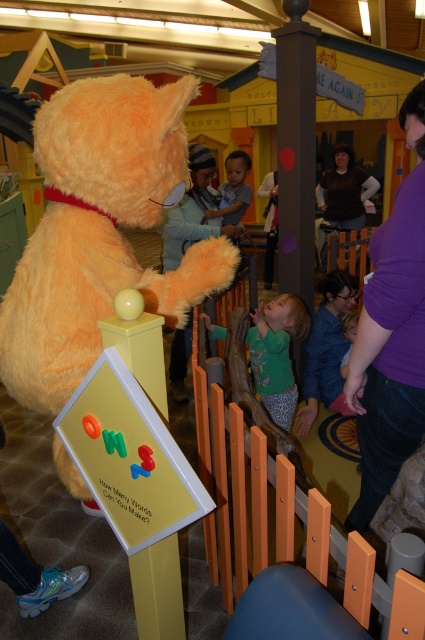
Between light blue sweater at center and brown fabric shirt at center, which one appears on the left side from the viewer's perspective?

Positioned to the left is light blue sweater at center.

Between point (195, 236) and point (322, 196), which one is positioned in front?

Point (195, 236) is in front.

Between point (170, 268) and point (323, 182), which one is positioned in front?

Point (170, 268) is more forward.

Where is `light blue sweater at center`? The height and width of the screenshot is (640, 425). light blue sweater at center is located at coordinates (193, 211).

Does fluffy orange teddy bear at left appear on the left side of brown fabric shirt at center?

Indeed, fluffy orange teddy bear at left is positioned on the left side of brown fabric shirt at center.

Can you confirm if fluffy orange teddy bear at left is taller than brown fabric shirt at center?

Indeed, fluffy orange teddy bear at left has a greater height compared to brown fabric shirt at center.

Image resolution: width=425 pixels, height=640 pixels. I want to click on fluffy orange teddy bear at left, so click(99, 230).

You are a GUI agent. You are given a task and a screenshot of the screen. Output one action in this format:
    pyautogui.click(x=<x>, y=<y>)
    Task: Click on the fluffy orange teddy bear at left
    
    Given the screenshot: What is the action you would take?
    pyautogui.click(x=99, y=230)

Does fluffy orange teddy bear at left have a larger size compared to blue denim jeans at lower right?

Indeed, fluffy orange teddy bear at left has a larger size compared to blue denim jeans at lower right.

Can you confirm if fluffy orange teddy bear at left is positioned to the left of blue denim jeans at lower right?

Yes, fluffy orange teddy bear at left is to the left of blue denim jeans at lower right.

Is point (16, 308) less distant than point (337, 352)?

That is True.

The width and height of the screenshot is (425, 640). What are the coordinates of `fluffy orange teddy bear at left` in the screenshot? It's located at (99, 230).